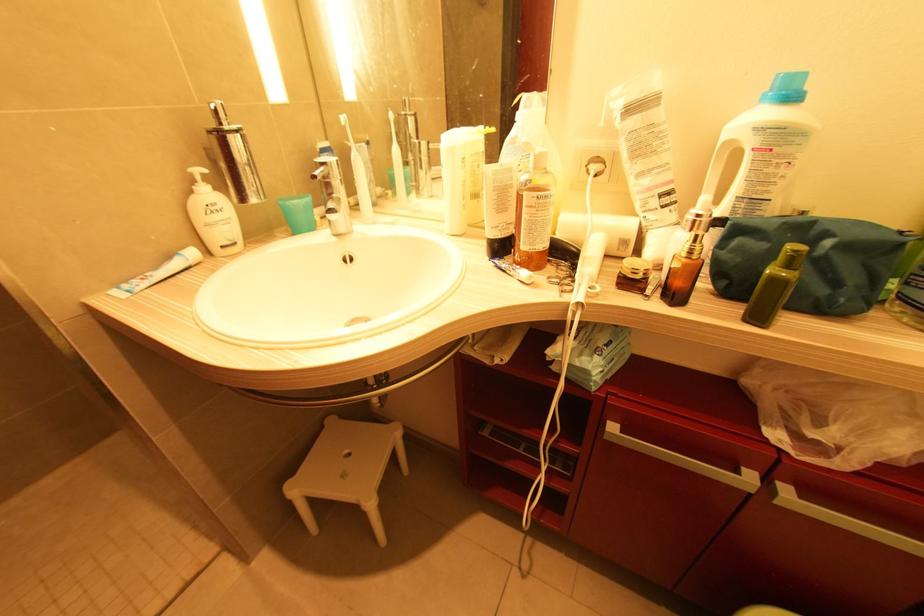
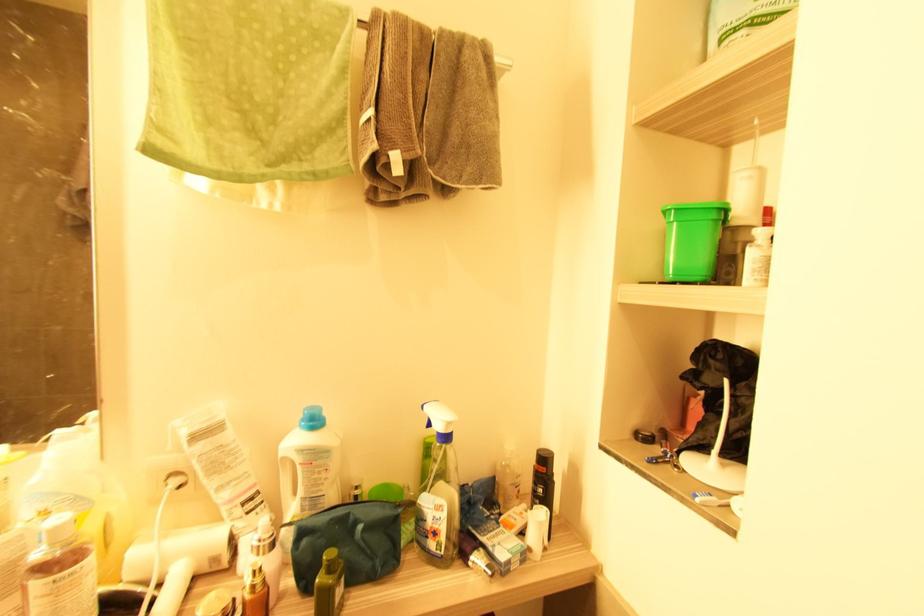
Where in the second image is the point corresponding to point 777,150 from the first image?

(315, 464)